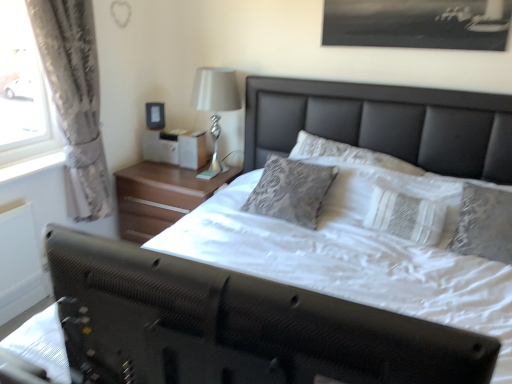
Question: Can you see matte black picture frame at upper center touching wooden nightstand at center?

Choices:
 (A) yes
 (B) no

Answer: (B)

Question: From a real-world perspective, does matte black picture frame at upper center sit lower than wooden nightstand at center?

Choices:
 (A) no
 (B) yes

Answer: (A)

Question: Does matte black picture frame at upper center appear on the right side of wooden nightstand at center?

Choices:
 (A) yes
 (B) no

Answer: (B)

Question: Can you confirm if matte black picture frame at upper center is taller than wooden nightstand at center?

Choices:
 (A) no
 (B) yes

Answer: (A)

Question: Does matte black picture frame at upper center turn towards wooden nightstand at center?

Choices:
 (A) yes
 (B) no

Answer: (B)

Question: Can wooden nightstand at center be found inside matte black picture frame at upper center?

Choices:
 (A) no
 (B) yes

Answer: (A)

Question: From a real-world perspective, is white textured pillow at center beneath white glossy lamp at upper right?

Choices:
 (A) no
 (B) yes

Answer: (B)

Question: Is white textured pillow at center next to white glossy lamp at upper right?

Choices:
 (A) no
 (B) yes

Answer: (A)

Question: Is white textured pillow at center not within white glossy lamp at upper right?

Choices:
 (A) no
 (B) yes

Answer: (B)

Question: Does white textured pillow at center have a greater height compared to white glossy lamp at upper right?

Choices:
 (A) yes
 (B) no

Answer: (B)

Question: Considering the relative sizes of white textured pillow at center and white glossy lamp at upper right in the image provided, is white textured pillow at center thinner than white glossy lamp at upper right?

Choices:
 (A) yes
 (B) no

Answer: (A)

Question: Considering the relative positions of white textured pillow at center and white glossy lamp at upper right in the image provided, is white textured pillow at center to the right of white glossy lamp at upper right from the viewer's perspective?

Choices:
 (A) no
 (B) yes

Answer: (B)

Question: Is white glossy lamp at upper right positioned beyond the bounds of wooden nightstand at center?

Choices:
 (A) no
 (B) yes

Answer: (B)